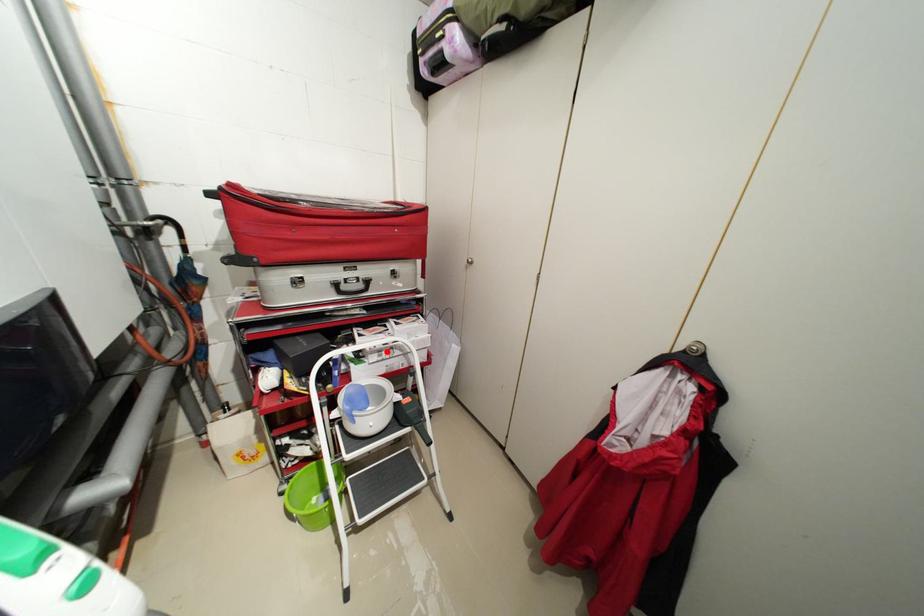
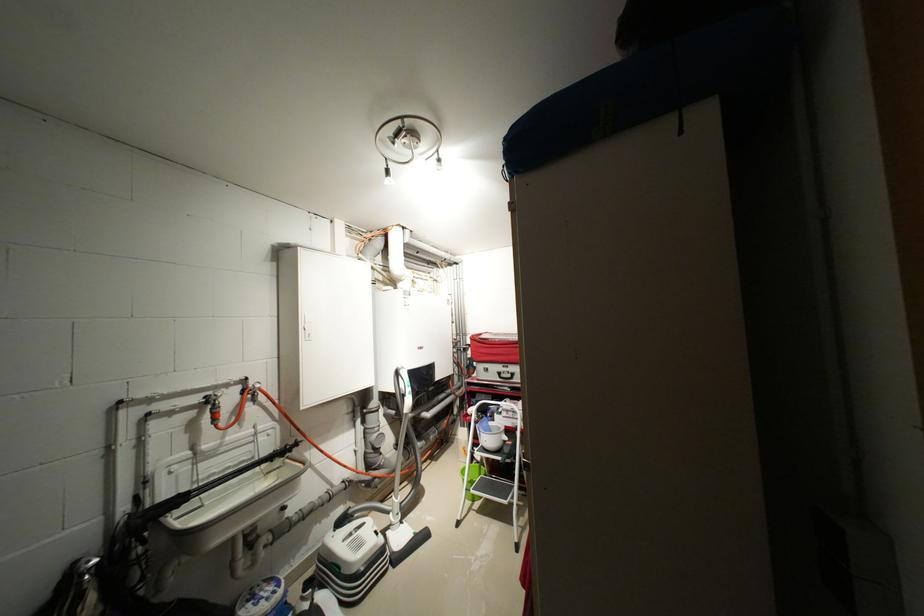
The point at the highlighted location is marked in the first image. Where is the corresponding point in the second image?

(515, 411)